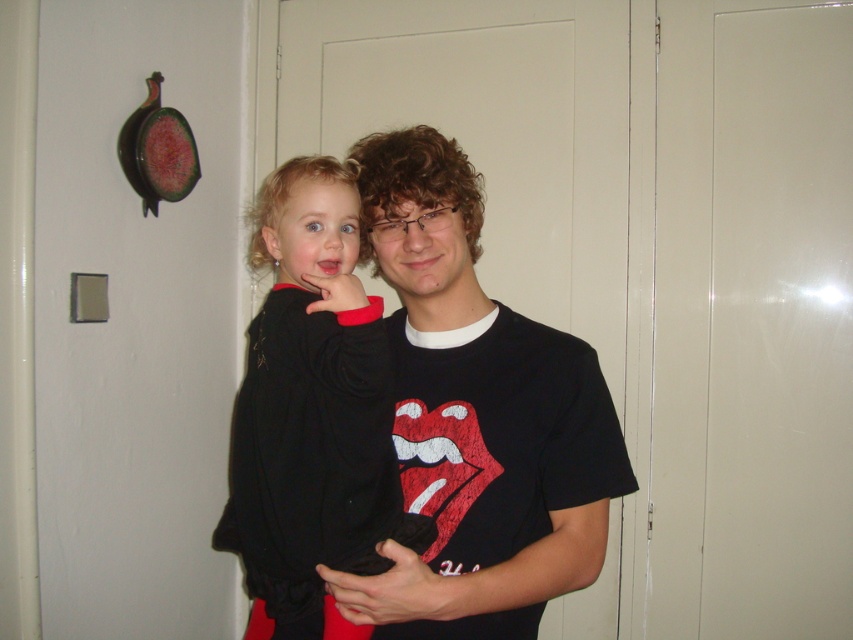
Can you confirm if black cotton t-shirt at center is bigger than black fleece sweater at center?

Yes.

Which is more to the left, black cotton t-shirt at center or black fleece sweater at center?

black fleece sweater at center

Where is `black cotton t-shirt at center`? black cotton t-shirt at center is located at coordinates (476, 417).

This screenshot has height=640, width=853. In order to click on black cotton t-shirt at center in this screenshot , I will do `click(476, 417)`.